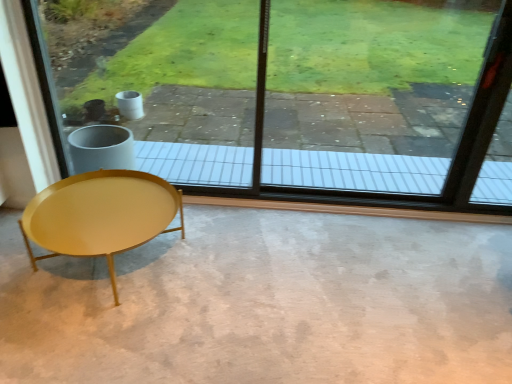
Describe the element at coordinates (266, 303) in the screenshot. The width and height of the screenshot is (512, 384). I see `smooth concrete floor at center` at that location.

The image size is (512, 384). Identify the location of transparent glass window at center. (292, 94).

Which of these two, transparent glass window at center or smooth concrete floor at center, is smaller?

smooth concrete floor at center.

Is transparent glass window at center in front of smooth concrete floor at center?

No, it is behind smooth concrete floor at center.

From a real-world perspective, between transparent glass window at center and smooth concrete floor at center, who is vertically higher?

transparent glass window at center.

Between point (194, 51) and point (344, 279), which one is positioned behind?

The point (194, 51) is behind.

From the image's perspective, is shiny gold coffee table at lower left below smooth concrete floor at center?

Answer: Incorrect, from the image's perspective, shiny gold coffee table at lower left is higher than smooth concrete floor at center.

Is shiny gold coffee table at lower left closer to camera compared to smooth concrete floor at center?

No, shiny gold coffee table at lower left is further to the viewer.

Is shiny gold coffee table at lower left bigger or smaller than smooth concrete floor at center?

Considering their sizes, shiny gold coffee table at lower left takes up less space than smooth concrete floor at center.

Which object is further away from the camera, transparent glass window at center or shiny gold coffee table at lower left?

transparent glass window at center is further away from the camera.

Is transparent glass window at center positioned far away from shiny gold coffee table at lower left?

Yes.

Is shiny gold coffee table at lower left a part of transparent glass window at center?

Definitely not — shiny gold coffee table at lower left is not inside transparent glass window at center.

Which of these two, transparent glass window at center or shiny gold coffee table at lower left, is wider?

shiny gold coffee table at lower left is wider.

Is smooth concrete floor at center outside of shiny gold coffee table at lower left?

That's correct, smooth concrete floor at center is outside of shiny gold coffee table at lower left.

From the picture: Between smooth concrete floor at center and shiny gold coffee table at lower left, which one has smaller width?

With smaller width is shiny gold coffee table at lower left.

Does smooth concrete floor at center have a greater height compared to shiny gold coffee table at lower left?

In fact, smooth concrete floor at center may be shorter than shiny gold coffee table at lower left.

Is point (290, 310) closer to viewer compared to point (91, 81)?

Yes, it is in front of point (91, 81).

In the scene shown: Is smooth concrete floor at center thinner than transparent glass window at center?

Incorrect, the width of smooth concrete floor at center is not less than that of transparent glass window at center.

Which of these two, smooth concrete floor at center or transparent glass window at center, stands shorter?

Standing shorter between the two is smooth concrete floor at center.

Is smooth concrete floor at center beside transparent glass window at center?

There is a gap between smooth concrete floor at center and transparent glass window at center.

What's the angular difference between shiny gold coffee table at lower left and transparent glass window at center's facing directions?

The angular difference between shiny gold coffee table at lower left and transparent glass window at center is 0.893 degrees.

From the image's perspective, is shiny gold coffee table at lower left under transparent glass window at center?

Correct, shiny gold coffee table at lower left appears lower than transparent glass window at center in the image.

Between shiny gold coffee table at lower left and transparent glass window at center, which one appears on the right side from the viewer's perspective?

transparent glass window at center.

Is shiny gold coffee table at lower left placed right next to transparent glass window at center?

No, shiny gold coffee table at lower left is not making contact with transparent glass window at center.

Locate an element on the screen. Image resolution: width=512 pixels, height=384 pixels. window lying on the right of smooth concrete floor at center is located at coordinates (292, 94).

Locate an element on the screen. coffee table on the left side of smooth concrete floor at center is located at coordinates (100, 215).

From the image, which object appears to be farther from transparent glass window at center, shiny gold coffee table at lower left or smooth concrete floor at center?

Among the two, shiny gold coffee table at lower left is located further to transparent glass window at center.

When comparing their distances from transparent glass window at center, does smooth concrete floor at center or shiny gold coffee table at lower left seem closer?

smooth concrete floor at center is closer to transparent glass window at center.

Looking at the image, which one is located closer to shiny gold coffee table at lower left, smooth concrete floor at center or transparent glass window at center?

smooth concrete floor at center is closer to shiny gold coffee table at lower left.

Which object lies nearer to the anchor point smooth concrete floor at center, shiny gold coffee table at lower left or transparent glass window at center?

The object closer to smooth concrete floor at center is shiny gold coffee table at lower left.

Which object lies further to the anchor point shiny gold coffee table at lower left, transparent glass window at center or smooth concrete floor at center?

transparent glass window at center is positioned further to the anchor shiny gold coffee table at lower left.

When comparing their distances from smooth concrete floor at center, does transparent glass window at center or shiny gold coffee table at lower left seem closer?

Among the two, shiny gold coffee table at lower left is located nearer to smooth concrete floor at center.

Locate an element on the screen. The height and width of the screenshot is (384, 512). concrete between shiny gold coffee table at lower left and transparent glass window at center in the horizontal direction is located at coordinates (266, 303).